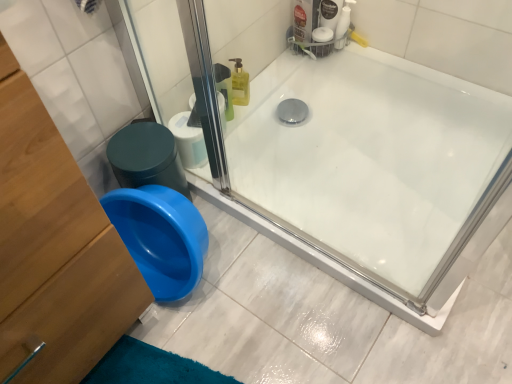
Question: From the image's perspective, is white glossy bathtub at center positioned above or below white matte toilet paper at center?

Choices:
 (A) below
 (B) above

Answer: (A)

Question: Does point (422, 102) appear closer or farther from the camera than point (193, 148)?

Choices:
 (A) closer
 (B) farther

Answer: (A)

Question: Which is farther from the white matte toilet paper at center?

Choices:
 (A) white glossy bathtub at center
 (B) wooden dresser at lower left

Answer: (B)

Question: Estimate the real-world distances between objects in this image. Which object is closer to the white glossy bathtub at center?

Choices:
 (A) wooden dresser at lower left
 (B) white matte toilet paper at center

Answer: (B)